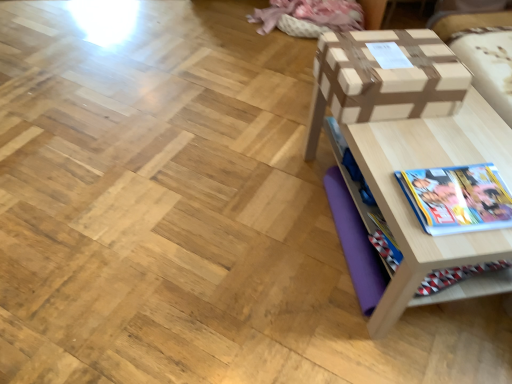
At what (x,y) coordinates should I click in order to perform the action: click on free region on the left part of wooden table at right. Please return your answer as a coordinate pair (x, y). This screenshot has height=384, width=512. Looking at the image, I should click on (236, 218).